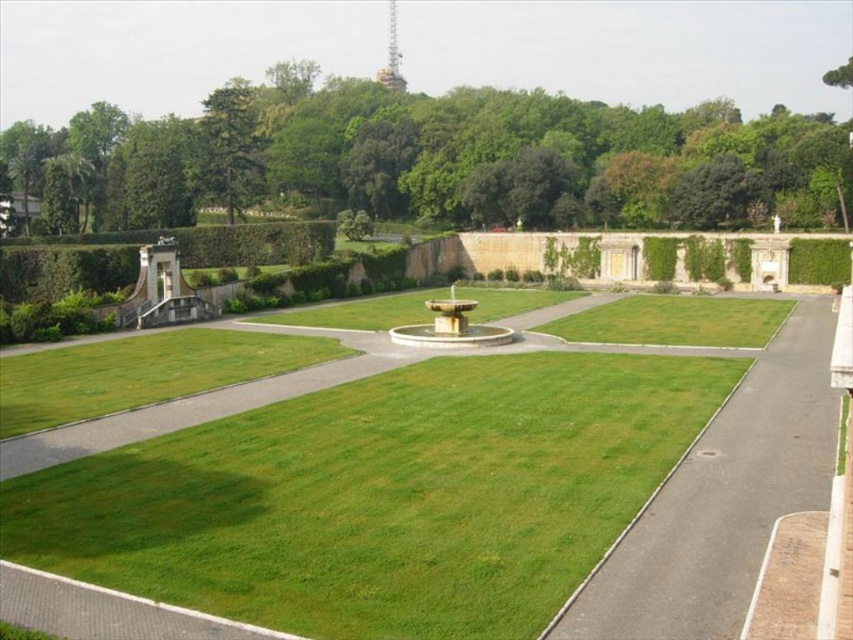
Question: Which point is farther to the camera?

Choices:
 (A) (235, 131)
 (B) (683, 563)

Answer: (A)

Question: Does green leafy tree at upper center have a larger size compared to green leafy tree at upper left?

Choices:
 (A) no
 (B) yes

Answer: (B)

Question: Does green leafy tree at upper center have a greater width compared to white stone fountain at center?

Choices:
 (A) yes
 (B) no

Answer: (A)

Question: Which point is farther from the camera taking this photo?

Choices:
 (A) (204, 182)
 (B) (802, 317)
 (C) (717, 168)

Answer: (A)

Question: Estimate the real-world distances between objects in this image. Which object is farther from the white stone fountain at center?

Choices:
 (A) green leafy tree at upper center
 (B) green grass at center
 (C) green leafy tree at upper left

Answer: (A)

Question: Is the position of green grass at center more distant than that of white stone fountain at center?

Choices:
 (A) no
 (B) yes

Answer: (A)